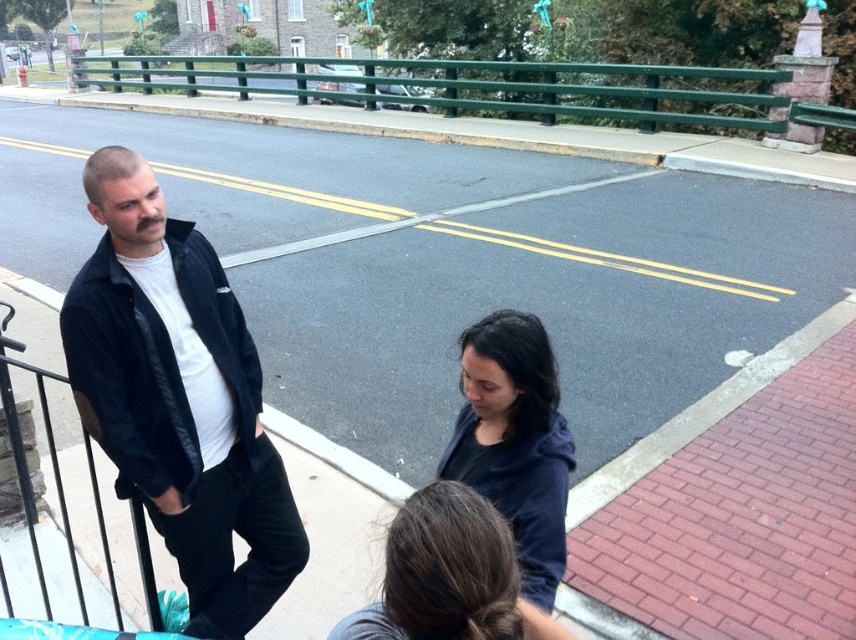
Does black leather jacket at left have a lesser height compared to green painted metal railing at upper center?

Indeed, black leather jacket at left has a lesser height compared to green painted metal railing at upper center.

Describe the element at coordinates (177, 397) in the screenshot. I see `black leather jacket at left` at that location.

Is point (129, 230) closer to camera compared to point (715, 115)?

Yes, point (129, 230) is closer to viewer.

Identify the location of black leather jacket at left. The height and width of the screenshot is (640, 856). (177, 397).

Is dark blue hoodie at center positioned in front of dark brown hair at lower center?

No, dark blue hoodie at center is behind dark brown hair at lower center.

Does dark blue hoodie at center have a lesser width compared to dark brown hair at lower center?

Yes, dark blue hoodie at center is thinner than dark brown hair at lower center.

Which is behind, point (535, 524) or point (447, 598)?

The point (535, 524) is behind.

At what (x,y) coordinates should I click in order to perform the action: click on dark blue hoodie at center. Please return your answer as a coordinate pair (x, y). The height and width of the screenshot is (640, 856). Looking at the image, I should click on (515, 442).

Can you confirm if black leather jacket at left is positioned to the right of dark brown hair at lower center?

Incorrect, black leather jacket at left is not on the right side of dark brown hair at lower center.

Does point (211, 456) lie in front of point (417, 588)?

No, it is behind (417, 588).

Image resolution: width=856 pixels, height=640 pixels. I want to click on black leather jacket at left, so click(177, 397).